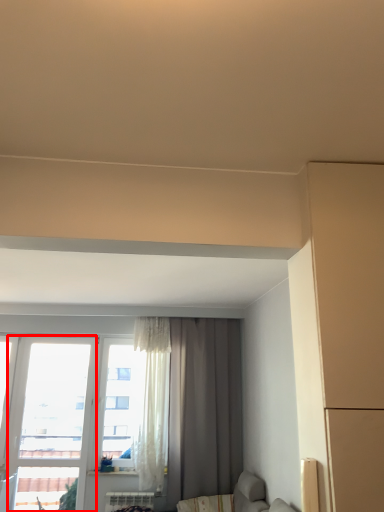
Question: From the image's perspective, what is the correct spatial positioning of window (annotated by the red box) in reference to curtain?

Choices:
 (A) above
 (B) below

Answer: (B)